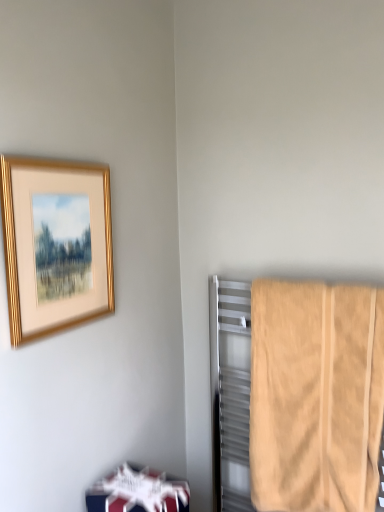
The image size is (384, 512). I want to click on white glossy bookshelf at lower left, so pos(138,492).

The height and width of the screenshot is (512, 384). Identify the location of beige cotton towel at right. (315, 396).

Is beige cotton towel at right touching white glossy bookshelf at lower left?

No, beige cotton towel at right is not making contact with white glossy bookshelf at lower left.

Which is behind, point (263, 285) or point (95, 510)?

The point (263, 285) is farther.

From a real-world perspective, is beige cotton towel at right physically located above or below white glossy bookshelf at lower left?

beige cotton towel at right is above white glossy bookshelf at lower left.

Considering the relative positions of beige cotton towel at right and white glossy bookshelf at lower left in the image provided, is beige cotton towel at right to the left of white glossy bookshelf at lower left from the viewer's perspective?

Incorrect, beige cotton towel at right is not on the left side of white glossy bookshelf at lower left.

Who is shorter, gold metallic picture frame at upper left or beige cotton towel at right?

With less height is gold metallic picture frame at upper left.

Can you tell me how much gold metallic picture frame at upper left and beige cotton towel at right differ in facing direction?

There is a 89.9-degree angle between the facing directions of gold metallic picture frame at upper left and beige cotton towel at right.

Image resolution: width=384 pixels, height=512 pixels. Find the location of `towel on the right side of gold metallic picture frame at upper left`. towel on the right side of gold metallic picture frame at upper left is located at coordinates (315, 396).

Which is more to the right, gold metallic picture frame at upper left or beige cotton towel at right?

beige cotton towel at right.

Considering the points (327, 293) and (44, 232), which point is in front, point (327, 293) or point (44, 232)?

The point (44, 232) is closer.

From the image's perspective, does beige cotton towel at right appear higher than gold metallic picture frame at upper left?

No, from the image's perspective, beige cotton towel at right is not on top of gold metallic picture frame at upper left.

This screenshot has height=512, width=384. In order to click on towel that is under the gold metallic picture frame at upper left (from a real-world perspective) in this screenshot , I will do `click(315, 396)`.

Which object is wider, beige cotton towel at right or gold metallic picture frame at upper left?

Wider between the two is beige cotton towel at right.

Does white glossy bookshelf at lower left appear on the right side of beige cotton towel at right?

In fact, white glossy bookshelf at lower left is to the left of beige cotton towel at right.

From a real-world perspective, is white glossy bookshelf at lower left located beneath beige cotton towel at right?

Yes, from a real-world perspective, white glossy bookshelf at lower left is below beige cotton towel at right.

How different are the orientations of white glossy bookshelf at lower left and beige cotton towel at right in degrees?

There is a 85.5-degree angle between the facing directions of white glossy bookshelf at lower left and beige cotton towel at right.

From the image's perspective, between white glossy bookshelf at lower left and beige cotton towel at right, which one is located above?

beige cotton towel at right is shown above in the image.

Is white glossy bookshelf at lower left facing away from gold metallic picture frame at upper left?

No, white glossy bookshelf at lower left's orientation is not away from gold metallic picture frame at upper left.

At what (x,y) coordinates should I click in order to perform the action: click on furniture beneath the gold metallic picture frame at upper left (from a real-world perspective). Please return your answer as a coordinate pair (x, y). This screenshot has width=384, height=512. Looking at the image, I should click on (138, 492).

What's the angular difference between white glossy bookshelf at lower left and gold metallic picture frame at upper left's facing directions?

white glossy bookshelf at lower left and gold metallic picture frame at upper left are facing 4.46 degrees away from each other.

From a real-world perspective, is white glossy bookshelf at lower left physically below gold metallic picture frame at upper left?

Correct, in the physical world, white glossy bookshelf at lower left is lower than gold metallic picture frame at upper left.

From the image's perspective, is gold metallic picture frame at upper left above or below white glossy bookshelf at lower left?

gold metallic picture frame at upper left is above white glossy bookshelf at lower left.

Is gold metallic picture frame at upper left oriented towards white glossy bookshelf at lower left?

No.

Between gold metallic picture frame at upper left and white glossy bookshelf at lower left, which one has larger width?

Wider between the two is white glossy bookshelf at lower left.

Measure the distance between gold metallic picture frame at upper left and white glossy bookshelf at lower left.

gold metallic picture frame at upper left is 60.80 centimeters away from white glossy bookshelf at lower left.

Image resolution: width=384 pixels, height=512 pixels. Find the location of `towel that appears above the white glossy bookshelf at lower left (from the image's perspective)`. towel that appears above the white glossy bookshelf at lower left (from the image's perspective) is located at coordinates (315, 396).

In the image, there is a gold metallic picture frame at upper left. Where is `towel below it (from a real-world perspective)`? Image resolution: width=384 pixels, height=512 pixels. towel below it (from a real-world perspective) is located at coordinates (315, 396).

Based on the photo, when comparing their distances from beige cotton towel at right, does gold metallic picture frame at upper left or white glossy bookshelf at lower left seem further?

Based on the image, gold metallic picture frame at upper left appears to be further to beige cotton towel at right.

Considering their positions, is beige cotton towel at right positioned further to white glossy bookshelf at lower left than gold metallic picture frame at upper left?

gold metallic picture frame at upper left lies further to white glossy bookshelf at lower left than the other object.

From the image, which object appears to be farther from gold metallic picture frame at upper left, white glossy bookshelf at lower left or beige cotton towel at right?

beige cotton towel at right lies further to gold metallic picture frame at upper left than the other object.

Considering their positions, is beige cotton towel at right positioned further to gold metallic picture frame at upper left than white glossy bookshelf at lower left?

Among the two, beige cotton towel at right is located further to gold metallic picture frame at upper left.

When comparing their distances from beige cotton towel at right, does white glossy bookshelf at lower left or gold metallic picture frame at upper left seem further?

gold metallic picture frame at upper left lies further to beige cotton towel at right than the other object.

Based on their spatial positions, is gold metallic picture frame at upper left or beige cotton towel at right further from white glossy bookshelf at lower left?

gold metallic picture frame at upper left is positioned further to the anchor white glossy bookshelf at lower left.

Locate an element on the screen. This screenshot has width=384, height=512. towel between gold metallic picture frame at upper left and white glossy bookshelf at lower left vertically is located at coordinates [315, 396].